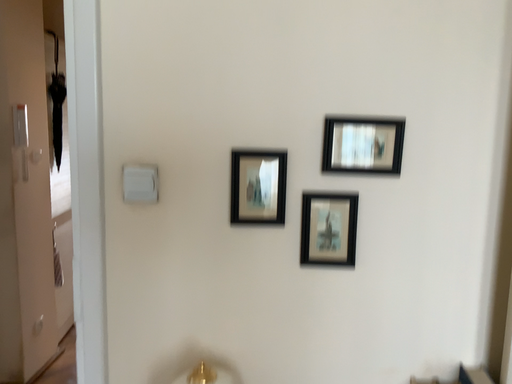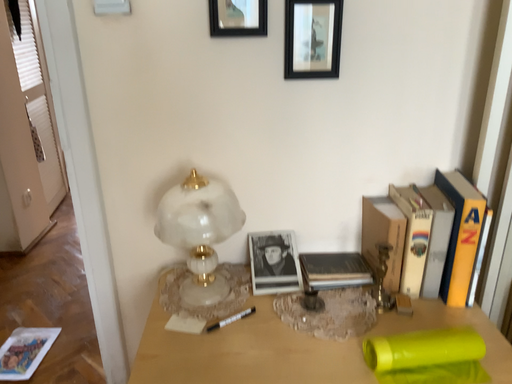
Question: Which way did the camera rotate in the video?

Choices:
 (A) rotated upward
 (B) rotated downward

Answer: (B)